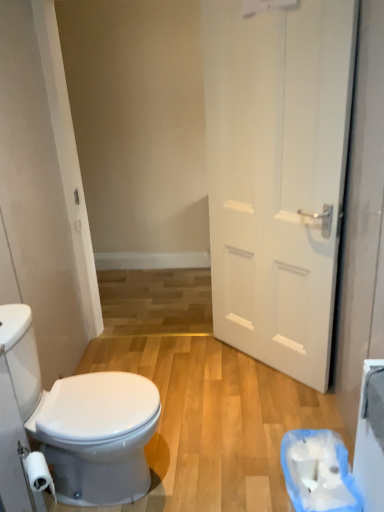
This screenshot has width=384, height=512. What are the coordinates of `spots to the right of white glossy bidet at lower left` in the screenshot? It's located at (202, 455).